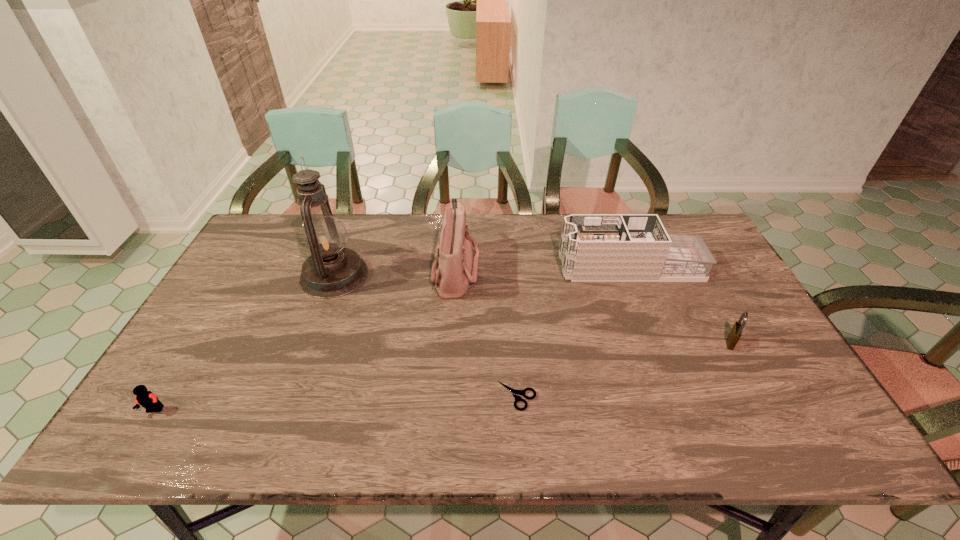
At what (x,y) coordinates should I click in order to perform the action: click on vacant position at the right edge of the desktop. Please return your answer as a coordinate pair (x, y). Looking at the image, I should click on (728, 301).

Image resolution: width=960 pixels, height=540 pixels. What are the coordinates of `vacant space at the far left corner of the desktop` in the screenshot? It's located at (283, 227).

You are a GUI agent. You are given a task and a screenshot of the screen. Output one action in this format:
    pyautogui.click(x=<x>, y=<y>)
    Task: Click on the vacant space at the far right corner of the desktop
    
    Given the screenshot: What is the action you would take?
    pyautogui.click(x=667, y=218)

Where is `unoccupied position between the padlock and the fourth object from right to left`? This screenshot has width=960, height=540. unoccupied position between the padlock and the fourth object from right to left is located at coordinates (593, 306).

Where is `blank region between the fourth tallest object and the leftmost object`? The image size is (960, 540). blank region between the fourth tallest object and the leftmost object is located at coordinates (443, 376).

Image resolution: width=960 pixels, height=540 pixels. What are the coordinates of `unoccupied position between the shears and the fourth shortest object` in the screenshot? It's located at (573, 332).

Where is `vacant space that's between the shortest object and the fourth tallest object`? This screenshot has width=960, height=540. vacant space that's between the shortest object and the fourth tallest object is located at coordinates (624, 369).

Where is `free area in between the third nearest object and the shoulder bag`? free area in between the third nearest object and the shoulder bag is located at coordinates (593, 306).

Locate an element on the screen. vacant area between the third object from right to left and the third object from left to right is located at coordinates (486, 333).

Identify the location of unoccupied position between the fourth shortest object and the shears. This screenshot has width=960, height=540. (573, 332).